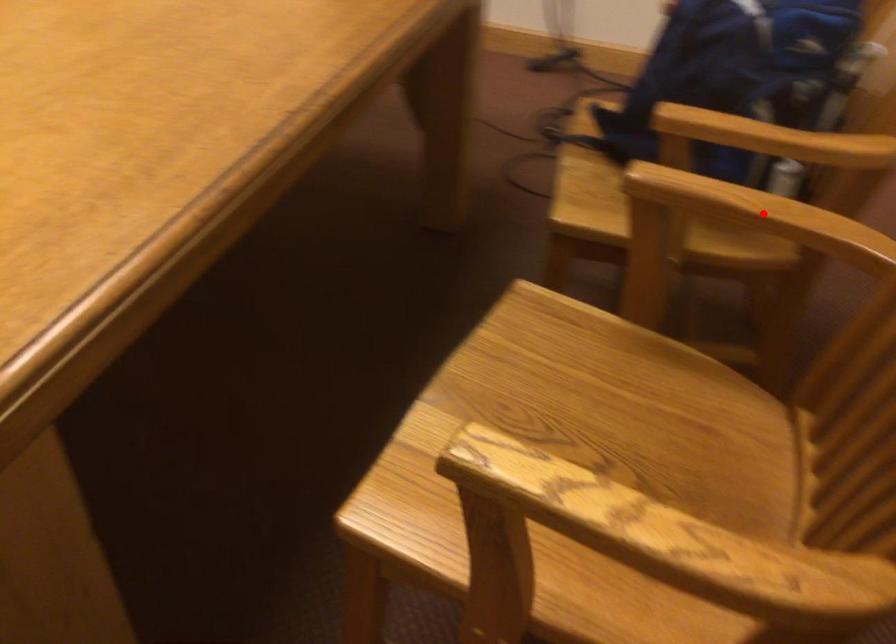
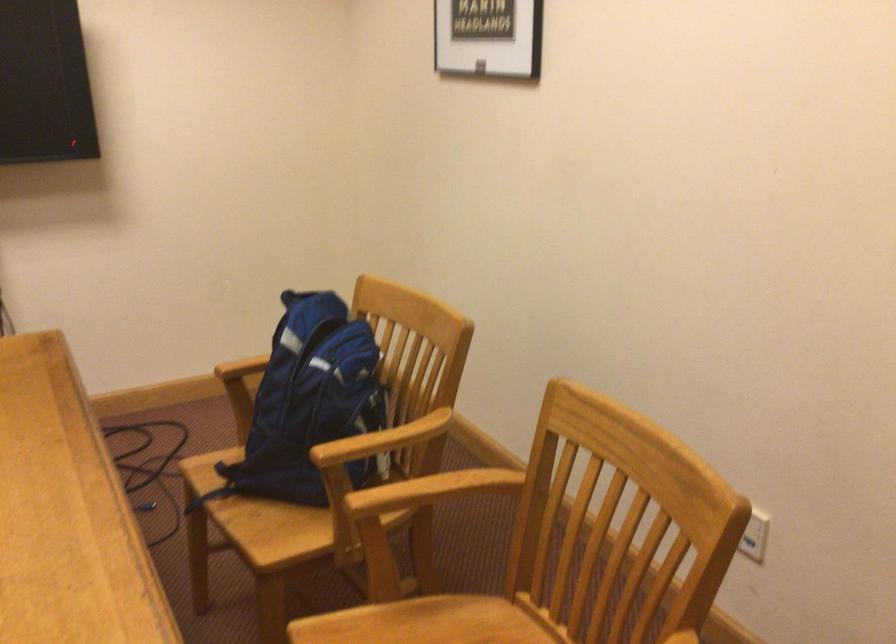
In the second image, find the point that corresponds to the highlighted location in the first image.

(436, 488)